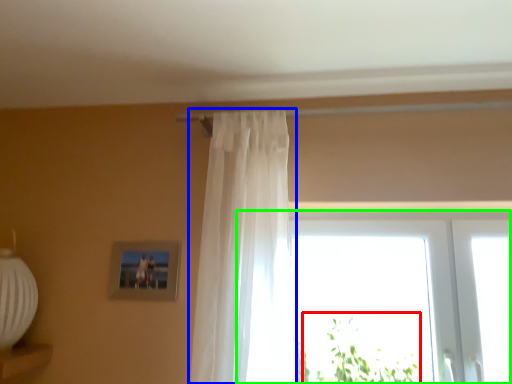
Question: Which is nearer to the plant (highlighted by a red box)? curtain (highlighted by a blue box) or window (highlighted by a green box).

Choices:
 (A) curtain
 (B) window

Answer: (B)